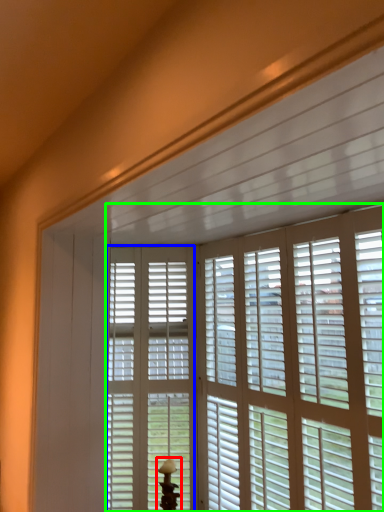
Question: Which object is the closest to the table lamp (highlighted by a red box)? Choose among these: screen door (highlighted by a blue box) or window blind (highlighted by a green box).

Choices:
 (A) screen door
 (B) window blind

Answer: (A)